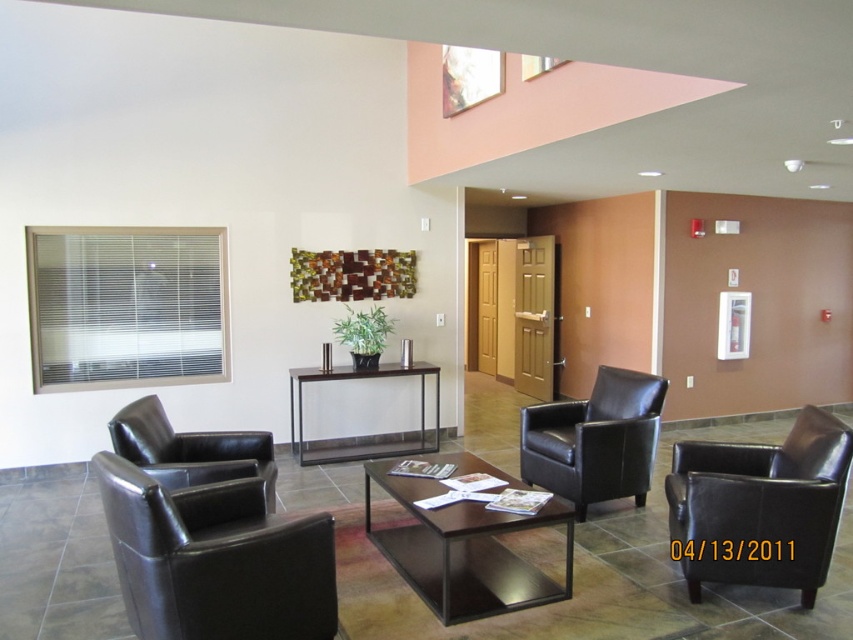
Is dark brown wood coffee table at center above black leather armchair at center?

No.

Is dark brown wood coffee table at center to the right of black leather armchair at center from the viewer's perspective?

No, dark brown wood coffee table at center is not to the right of black leather armchair at center.

Is point (467, 618) more distant than point (651, 378)?

No, it is not.

This screenshot has height=640, width=853. I want to click on dark brown wood coffee table at center, so click(x=463, y=550).

Is black leather armchair at center smaller than metallic/reflective console table at center?

Correct, black leather armchair at center occupies less space than metallic/reflective console table at center.

Is point (636, 486) farther from viewer compared to point (300, 401)?

No, (636, 486) is closer to viewer.

The height and width of the screenshot is (640, 853). I want to click on black leather armchair at center, so click(x=595, y=440).

Based on the photo, between black leather chair at center and black leather armchair at left, which one has more height?

black leather chair at center is taller.

Is black leather chair at center taller than black leather armchair at left?

Yes.

The image size is (853, 640). Describe the element at coordinates (759, 506) in the screenshot. I see `black leather chair at center` at that location.

Where is `black leather chair at center`? black leather chair at center is located at coordinates (759, 506).